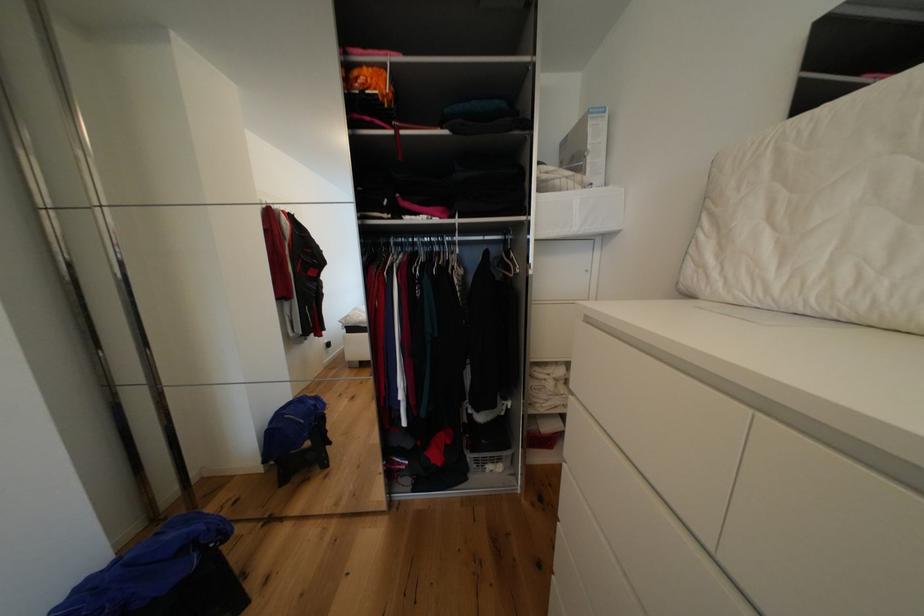
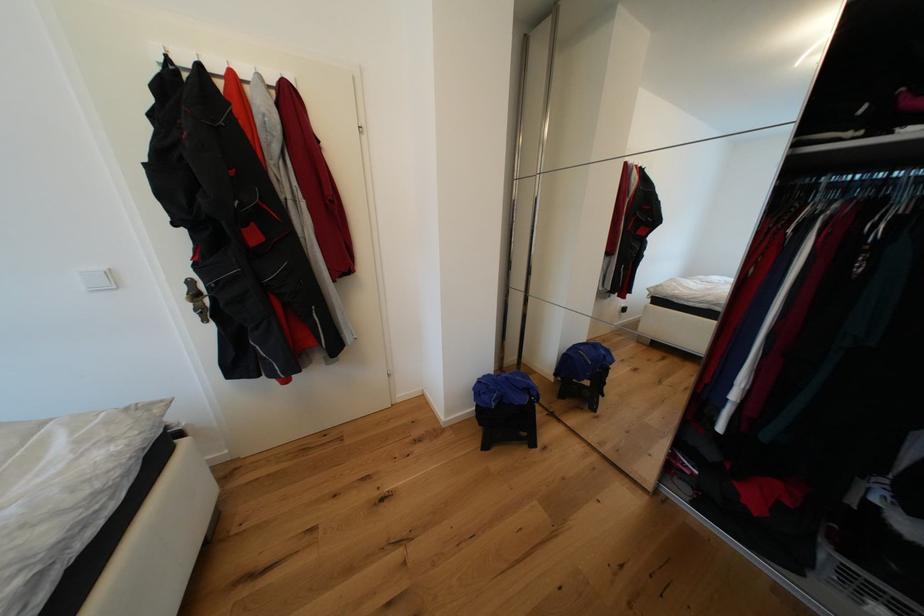
Question: The camera is either moving clockwise (left) or counter-clockwise (right) around the object. The first image is from the beginning of the video and the second image is from the end. Is the camera moving left or right when shooting the video?

Choices:
 (A) Left
 (B) Right

Answer: (B)